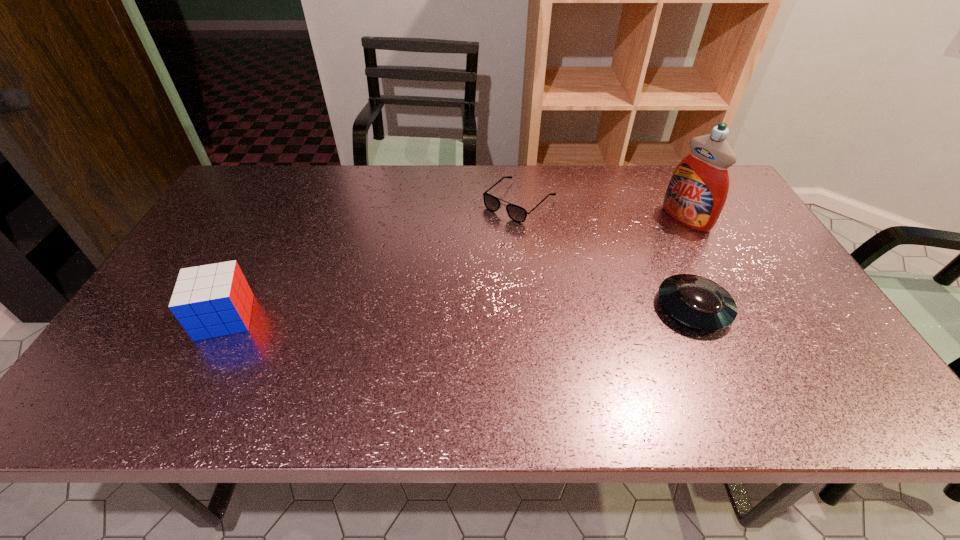
Find the location of a particular element. free space between the tallest object and the leftmost object is located at coordinates (455, 268).

You are a GUI agent. You are given a task and a screenshot of the screen. Output one action in this format:
    pyautogui.click(x=<x>, y=<y>)
    Task: Click on the vacant area that lies between the spectacles and the cube
    This screenshot has width=960, height=540.
    Given the screenshot: What is the action you would take?
    pyautogui.click(x=372, y=259)

In order to click on vacant area that lies between the saucer and the third object from right to left in this screenshot , I will do `click(607, 254)`.

Identify the location of empty location between the second tallest object and the saucer. (459, 312).

At what (x,y) coordinates should I click in order to perform the action: click on free space between the saucer and the leftmost object. Please return your answer as a coordinate pair (x, y). This screenshot has height=540, width=960. Looking at the image, I should click on (459, 312).

I want to click on object that stands as the closest to the detergent, so click(x=700, y=303).

Where is `object that stands as the closest to the saucer`? Image resolution: width=960 pixels, height=540 pixels. object that stands as the closest to the saucer is located at coordinates (696, 194).

Locate an element on the screen. The image size is (960, 540). free space that satisfies the following two spatial constraints: 1. on the back side of the detergent; 2. on the right side of the leftmost object is located at coordinates (277, 219).

This screenshot has width=960, height=540. What are the coordinates of `vacant space that satisfies the following two spatial constraints: 1. on the front side of the detergent; 2. on the right side of the third object from right to left` in the screenshot? It's located at (521, 219).